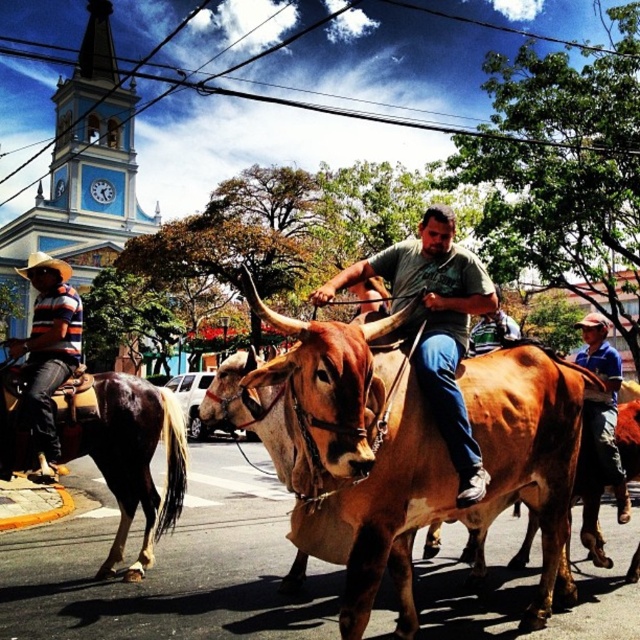
You are a photographer standing in the street scene. You want to capture a photo where both the brown glossy horse at lower left and the matte green shirt at center are visible. Which object should you focus on first to ensure both are in frame?

The brown glossy horse at lower left has a lesser height compared to matte green shirt at center, so you should focus on the brown glossy horse at lower left first to ensure both are in frame.

You are a tourist standing on the street and want to take a photo of the brown leather bull at center and the matte green shirt at center. Which object should you focus on first if you want to capture both in one frame without moving the camera?

You should focus on the brown leather bull at center first because it is located below the matte green shirt at center, so adjusting the camera to include the lower position of the bull will naturally include the shirt above it in the frame.

You are a photographer standing at the edge of the street. You want to take a photo that includes both the brown leather bull at center and the matte green shirt at center. What is the minimum distance you need to move backward to ensure both are fully visible in the frame?

The brown leather bull at center and the matte green shirt at center are 3.82 meters apart. To capture both in the frame, you need to move back at least 3.82 meters to ensure they are fully visible.